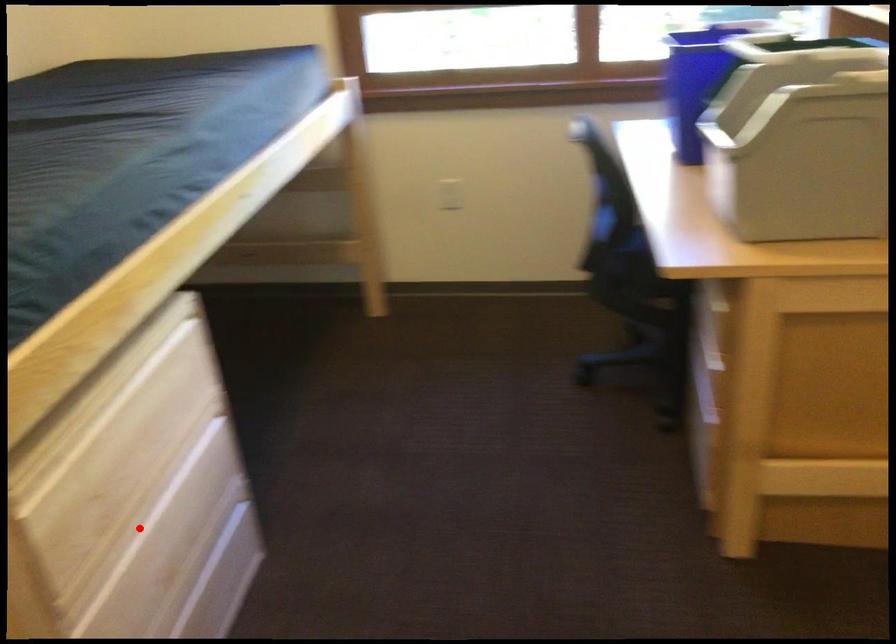
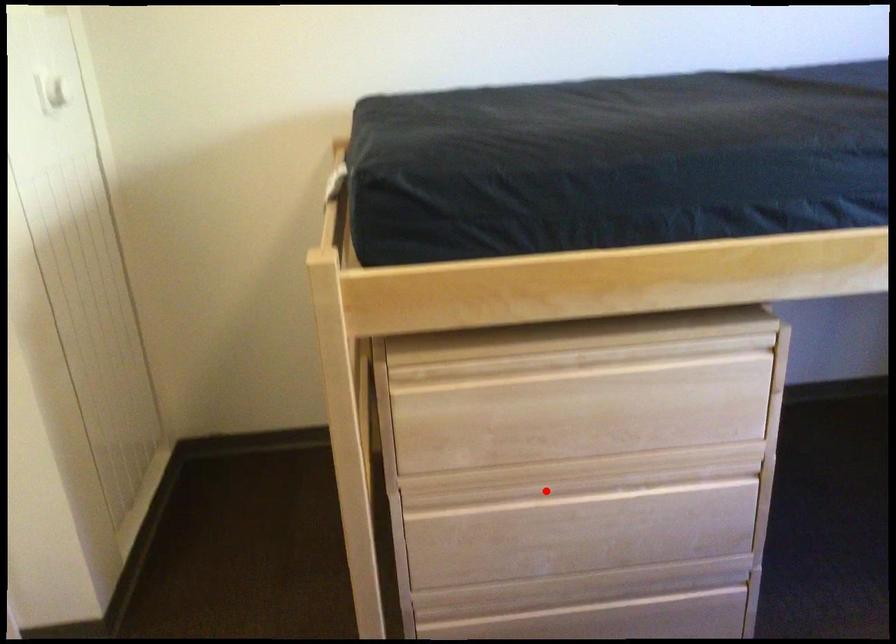
I am providing you with two images of the same scene from different viewpoints. A red point is marked on the first image and another point is marked on the second image. Do the highlighted points in image1 and image2 indicate the same real-world spot?

Yes